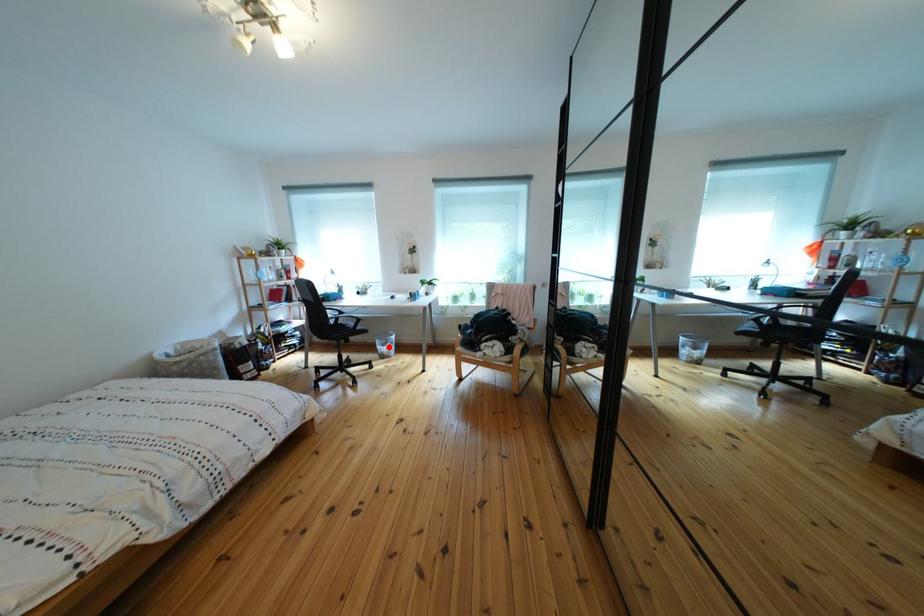
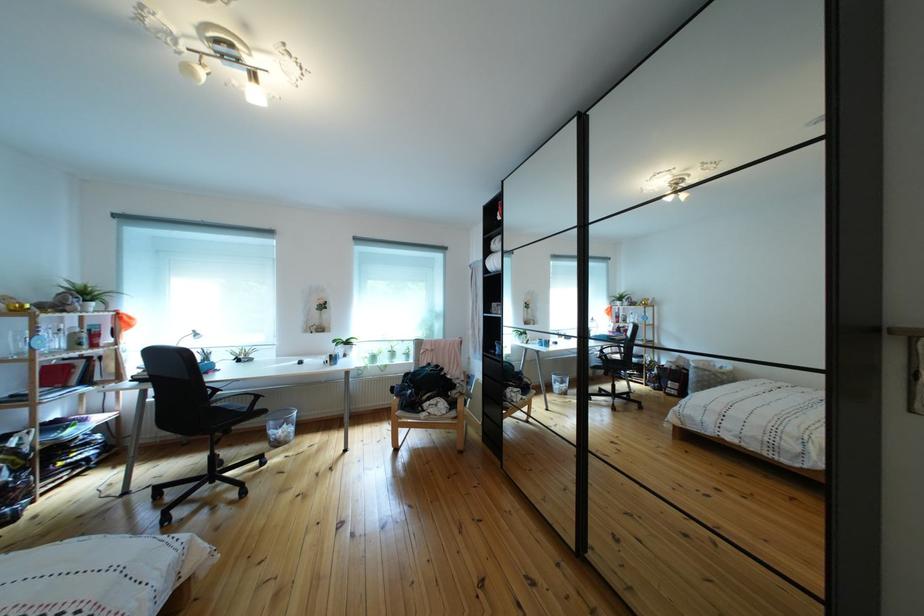
Find the pixel in the second image that matches the highlighted location in the first image.

(283, 430)